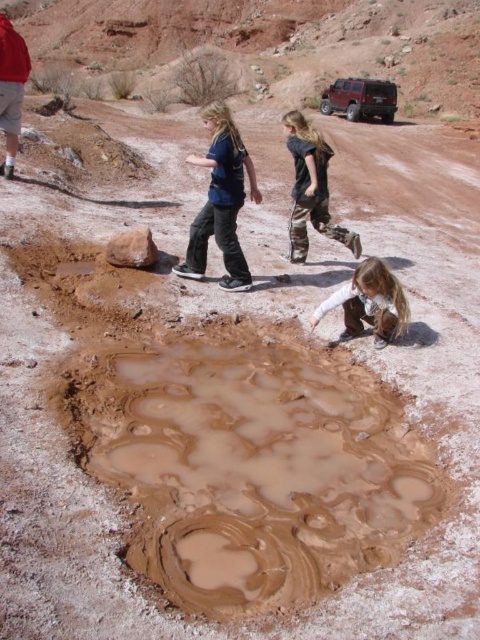
You are a photographer trying to capture both the blue cotton shirt at center and the matte red shirt at upper left in a single frame. Which shirt should you focus on first to ensure both are in the frame?

The blue cotton shirt at center is taller than the matte red shirt at upper left, so you should focus on the blue cotton shirt at center first to ensure both are in the frame.

You are standing at point [226,129] and want to walk to the muddy pool in the desert. Which direction should you move relative to point [197,609]?

You should move towards point [197,609] because it is in front of point [226,129], meaning the muddy pool is located in that direction.